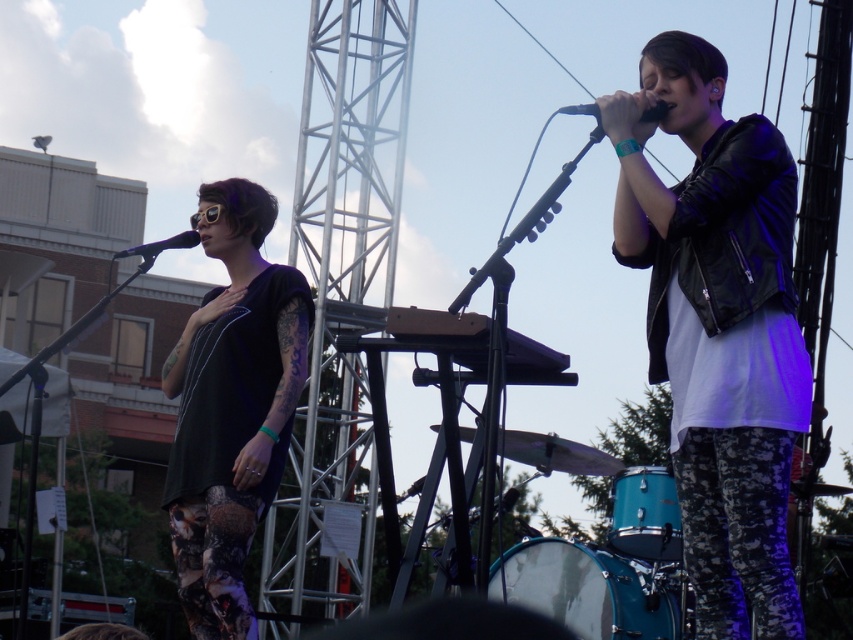
Question: Which point is farther from the camera taking this photo?

Choices:
 (A) (706, 256)
 (B) (572, 113)
 (C) (143, 250)

Answer: (C)

Question: Which is nearer to the black matte microphone at left?

Choices:
 (A) black matte microphone at upper center
 (B) black matte shirt at left

Answer: (B)

Question: Which object is positioned farthest from the black matte shirt at left?

Choices:
 (A) black matte microphone at left
 (B) leather jacket at upper right

Answer: (B)

Question: Is black matte shirt at left wider than black matte microphone at left?

Choices:
 (A) yes
 (B) no

Answer: (B)

Question: Is leather jacket at upper right below black matte microphone at left?

Choices:
 (A) yes
 (B) no

Answer: (A)

Question: Observing the image, what is the correct spatial positioning of leather jacket at upper right in reference to black matte microphone at upper center?

Choices:
 (A) left
 (B) right

Answer: (B)